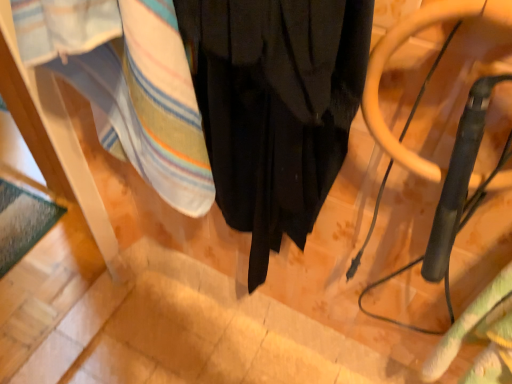
Question: From a real-world perspective, is black matte curtain at center beneath metallic gray swivel chair at right?

Choices:
 (A) yes
 (B) no

Answer: (A)

Question: Can you confirm if black matte curtain at center is smaller than metallic gray swivel chair at right?

Choices:
 (A) yes
 (B) no

Answer: (B)

Question: Considering the relative sizes of black matte curtain at center and metallic gray swivel chair at right in the image provided, is black matte curtain at center thinner than metallic gray swivel chair at right?

Choices:
 (A) yes
 (B) no

Answer: (B)

Question: Is black matte curtain at center wider than metallic gray swivel chair at right?

Choices:
 (A) no
 (B) yes

Answer: (B)

Question: From the image's perspective, is black matte curtain at center under metallic gray swivel chair at right?

Choices:
 (A) yes
 (B) no

Answer: (B)

Question: From the image's perspective, is striped cotton towel at lower left, which is the 1th blanket from left to right, located above or below metallic gray swivel chair at right?

Choices:
 (A) above
 (B) below

Answer: (A)

Question: In the image, is striped cotton towel at lower left, the second blanket viewed from the right, on the left side or the right side of metallic gray swivel chair at right?

Choices:
 (A) right
 (B) left

Answer: (B)

Question: Relative to metallic gray swivel chair at right, is striped cotton towel at lower left, which is counted as the first blanket, starting from the top, in front or behind?

Choices:
 (A) front
 (B) behind

Answer: (B)

Question: Looking at the image, does striped cotton towel at lower left, which is counted as the first blanket, starting from the top, seem bigger or smaller compared to metallic gray swivel chair at right?

Choices:
 (A) small
 (B) big

Answer: (B)

Question: Would you say striped cotton towel at lower left, which is the 1th blanket from left to right, is inside or outside black matte curtain at center?

Choices:
 (A) outside
 (B) inside

Answer: (A)

Question: In terms of size, does striped cotton towel at lower left, which is counted as the 2th blanket, starting from the bottom, appear bigger or smaller than black matte curtain at center?

Choices:
 (A) big
 (B) small

Answer: (A)

Question: In terms of height, does striped cotton towel at lower left, which is the 1th blanket from left to right, look taller or shorter compared to black matte curtain at center?

Choices:
 (A) short
 (B) tall

Answer: (A)

Question: From a real-world perspective, is striped cotton towel at lower left, which is counted as the first blanket, starting from the top, physically located above or below black matte curtain at center?

Choices:
 (A) below
 (B) above

Answer: (B)

Question: From the image's perspective, is black matte curtain at center positioned above or below striped cotton towel at lower left, which is the 1th blanket from left to right?

Choices:
 (A) above
 (B) below

Answer: (B)

Question: Does point (304, 238) appear closer or farther from the camera than point (174, 168)?

Choices:
 (A) farther
 (B) closer

Answer: (A)